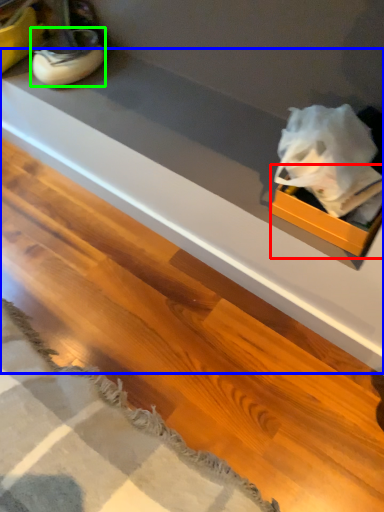
Question: Based on their relative distances, which object is farther from box (highlighted by a red box)? Choose from counter top (highlighted by a blue box) and footwear (highlighted by a green box).

Choices:
 (A) counter top
 (B) footwear

Answer: (B)